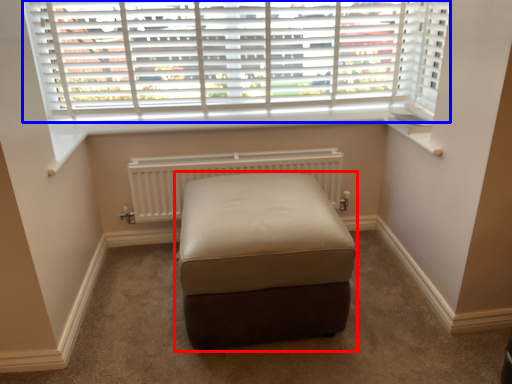
Question: Which of the following is the closest to the observer, furniture (highlighted by a red box) or window (highlighted by a blue box)?

Choices:
 (A) furniture
 (B) window

Answer: (A)